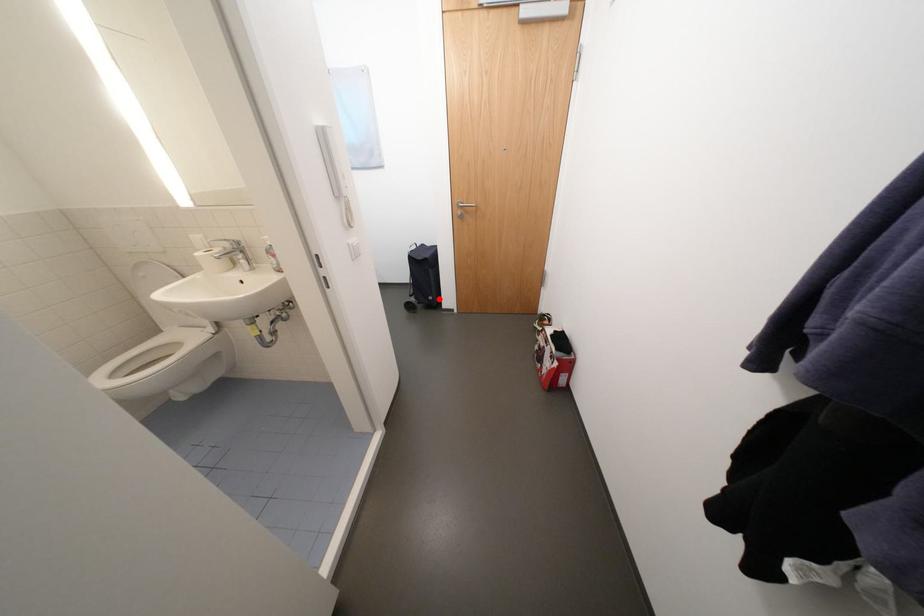
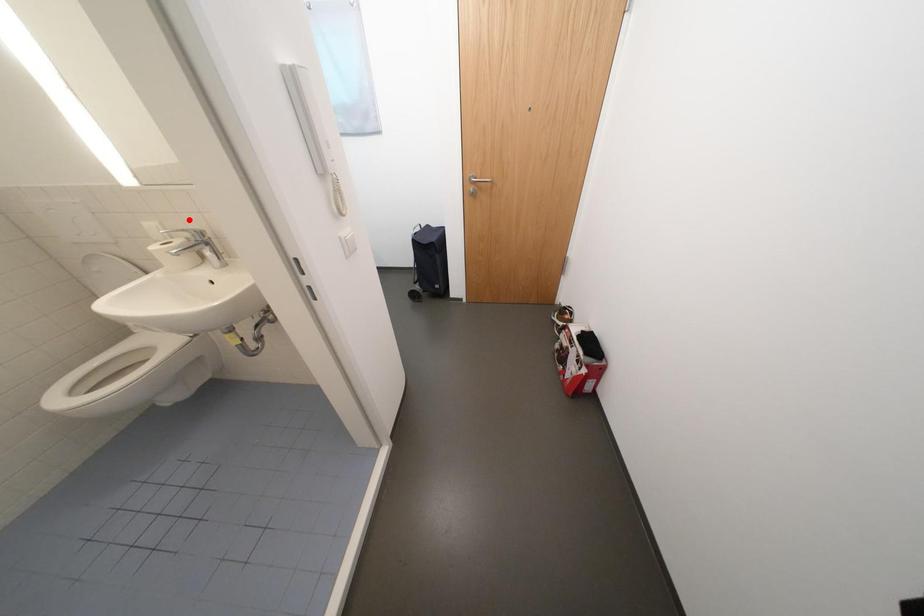
I am providing you with two images of the same scene from different viewpoints. A red point is marked on the first image and another point is marked on the second image. Is the marked point in image1 the same physical position as the marked point in image2?

No